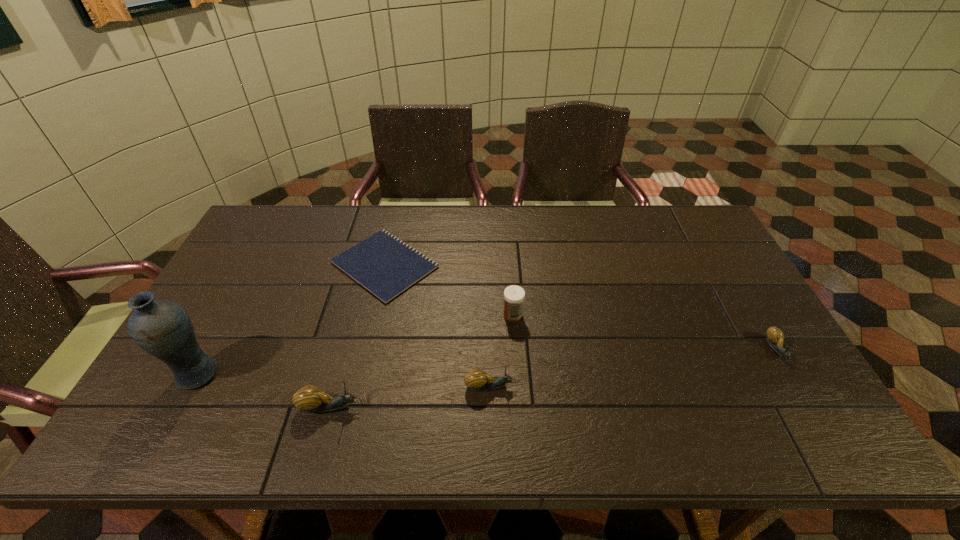
The width and height of the screenshot is (960, 540). Find the location of `the second farthest object`. the second farthest object is located at coordinates (514, 295).

Find the location of a particular element. The width and height of the screenshot is (960, 540). free location located 0.290m on the front-facing side of the nearest object is located at coordinates (485, 407).

Locate an element on the screen. free space located 0.070m on the front-facing side of the third shortest object is located at coordinates (543, 386).

Locate an element on the screen. free spot located on the front of the farthest object is located at coordinates (361, 368).

Image resolution: width=960 pixels, height=540 pixels. Find the location of `vacant space located on the right of the tallest object`. vacant space located on the right of the tallest object is located at coordinates (295, 374).

You are a GUI agent. You are given a task and a screenshot of the screen. Output one action in this format:
    pyautogui.click(x=<x>, y=<y>)
    Task: Click on the vacant space located 0.090m on the front of the fifth nearest object
    
    Given the screenshot: What is the action you would take?
    click(x=516, y=349)

Find the location of a particular element. object that is at the far edge is located at coordinates (383, 264).

Image resolution: width=960 pixels, height=540 pixels. I want to click on vase positioned at the near edge, so click(x=162, y=328).

Where is `object positioned at the left edge`? object positioned at the left edge is located at coordinates click(162, 328).

At what (x,y) coordinates should I click in order to perform the action: click on object that is at the right edge. Please return your answer as a coordinate pair (x, y). Looking at the image, I should click on (775, 337).